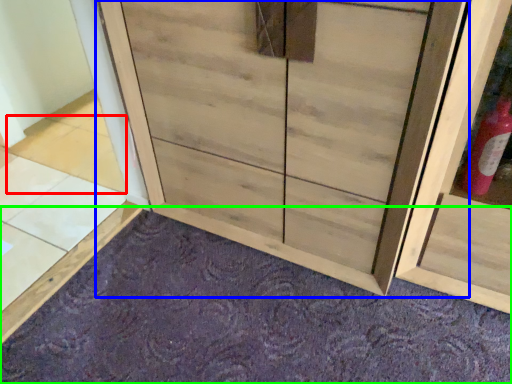
Question: Which object is positioned farthest from tile (highlighted by a red box)? Select from cupboard (highlighted by a blue box) and plain (highlighted by a green box).

Choices:
 (A) cupboard
 (B) plain

Answer: (B)